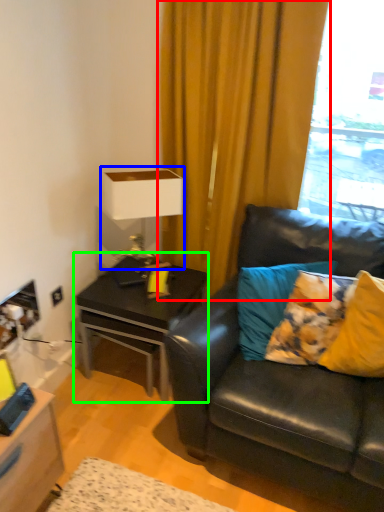
Question: Estimate the real-world distances between objects in this image. Which object is closer to curtain (highlighted by a red box), table lamp (highlighted by a blue box) or table (highlighted by a green box)?

Choices:
 (A) table lamp
 (B) table

Answer: (A)